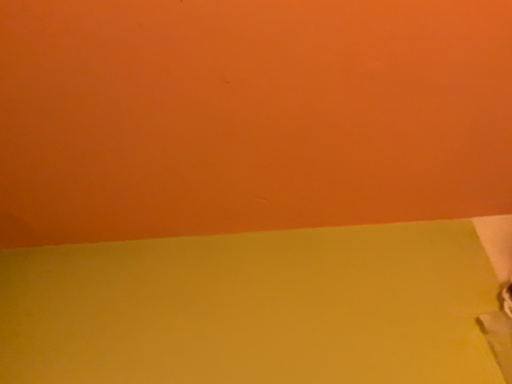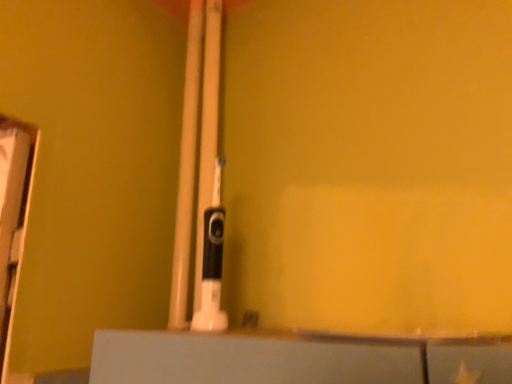
Question: How did the camera likely rotate when shooting the video?

Choices:
 (A) rotated downward
 (B) rotated upward

Answer: (A)